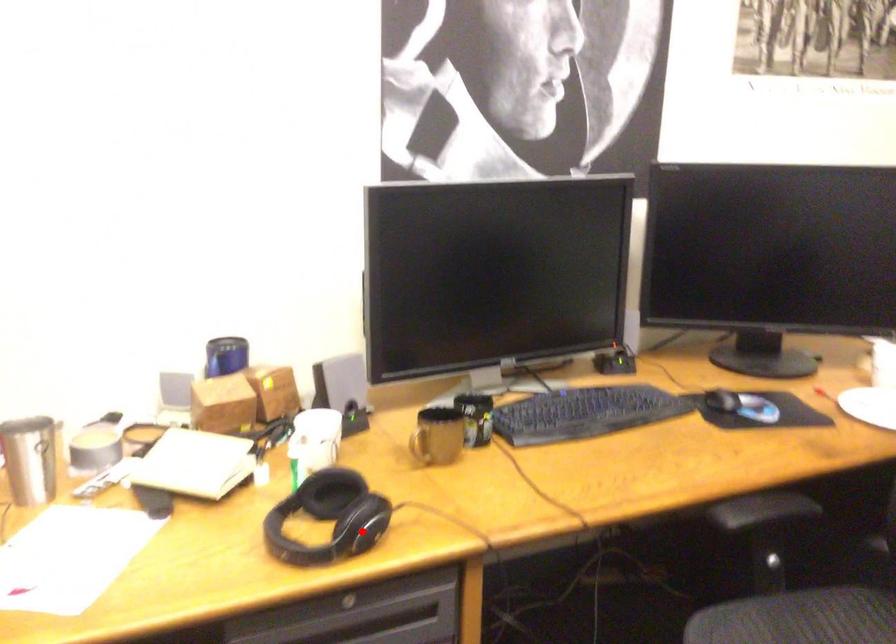
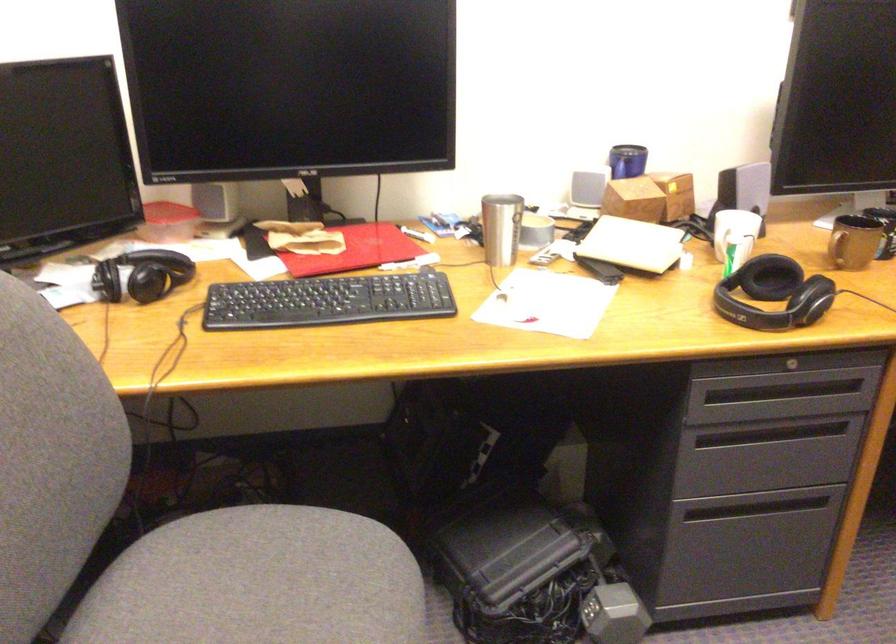
Find the pixel in the second image that matches the highlighted location in the first image.

(810, 299)